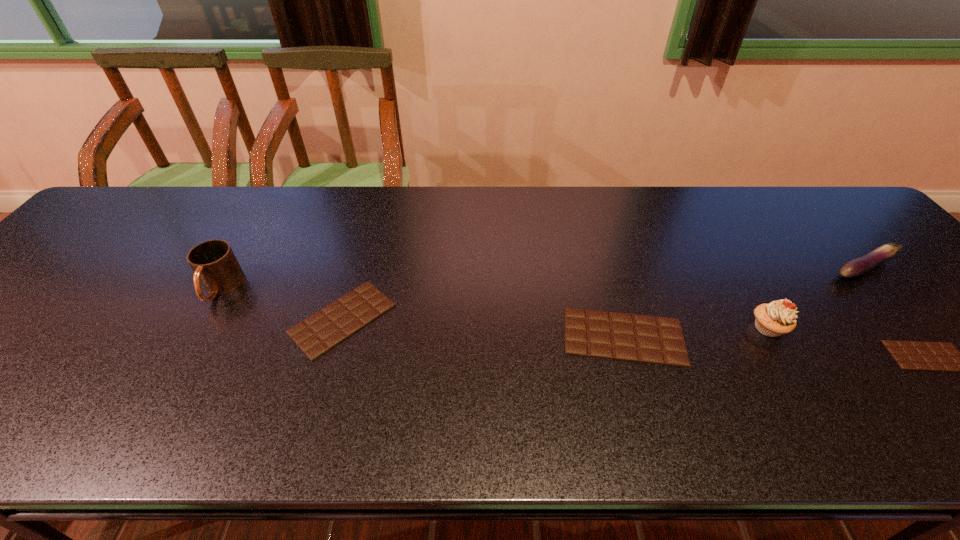
At what (x,y) coordinates should I click in order to perform the action: click on empty space between the leftmost object and the second chocolate bar from right to left. Please return your answer as a coordinate pair (x, y). Image resolution: width=960 pixels, height=540 pixels. Looking at the image, I should click on pos(421,312).

Find the location of a particular element. The height and width of the screenshot is (540, 960). free point between the leftmost object and the eggplant is located at coordinates (542, 278).

Locate an element on the screen. The width and height of the screenshot is (960, 540). free spot between the leftmost object and the fifth object from right to left is located at coordinates (281, 303).

Locate an element on the screen. Image resolution: width=960 pixels, height=540 pixels. free space between the third object from right to left and the third tallest object is located at coordinates (816, 298).

Where is `vacant area that lies between the fourth object from right to left and the eggplant`? vacant area that lies between the fourth object from right to left and the eggplant is located at coordinates (744, 302).

Find the location of `free space between the mug and the cupcake`. free space between the mug and the cupcake is located at coordinates (494, 307).

Find the location of a particular element. Image resolution: width=960 pixels, height=540 pixels. unoccupied area between the cupcake and the eggplant is located at coordinates (816, 298).

At what (x,y) coordinates should I click in order to perform the action: click on vacant space that is in between the cupcake and the leftmost chocolate bar. Please return your answer as a coordinate pair (x, y). The image size is (960, 540). Looking at the image, I should click on (555, 323).

Select which object is the second closest to the second shortest chocolate bar. Please provide its 2D coordinates. Your answer should be formatted as a tuple, i.e. [(x, y)], where the tuple contains the x and y coordinates of a point satisfying the conditions above.

[(599, 334)]

The height and width of the screenshot is (540, 960). Find the location of `object that is the third closest to the shortest chocolate bar`. object that is the third closest to the shortest chocolate bar is located at coordinates (599, 334).